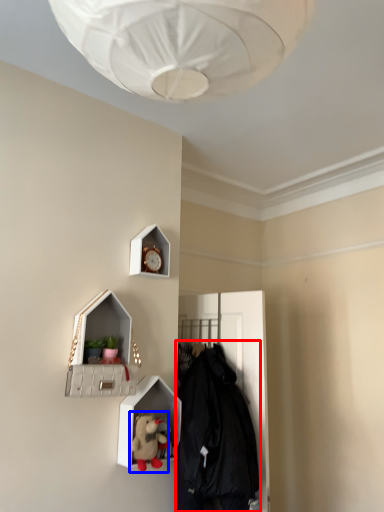
Question: Which object appears farthest to the camera in this image, clothing (highlighted by a red box) or toy (highlighted by a blue box)?

Choices:
 (A) clothing
 (B) toy

Answer: (B)